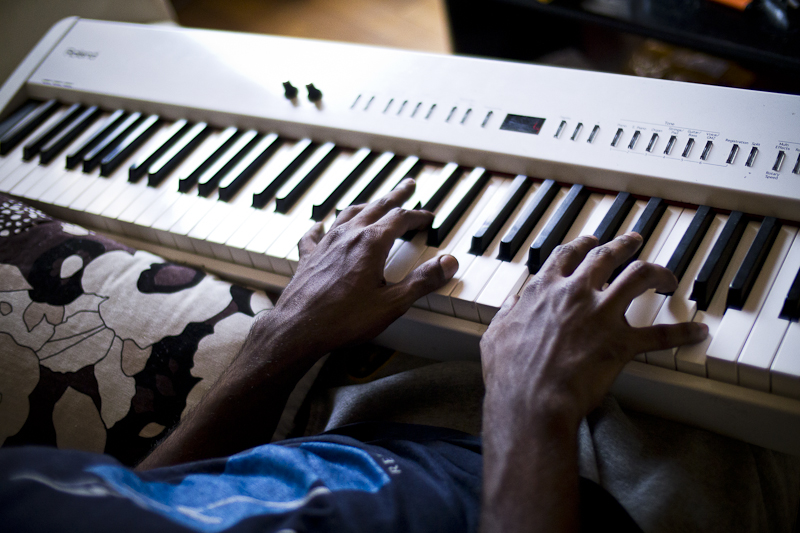
Locate an element on the screen. finger touching piano is located at coordinates (309, 231), (348, 208), (384, 201), (406, 217), (432, 266), (504, 306), (564, 247), (598, 253), (638, 272), (669, 327).